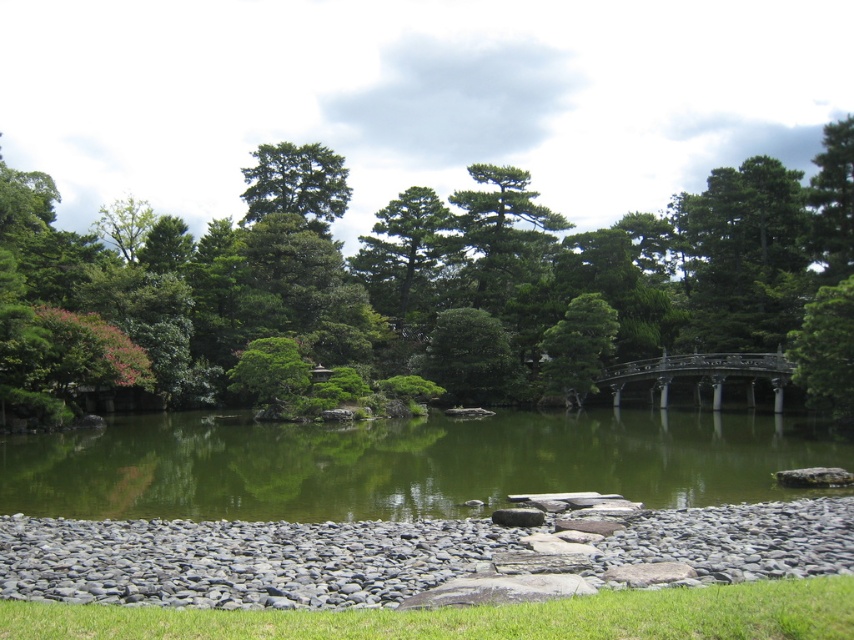
You are standing at the entrance of the Japanese garden and want to find the green matte tree at center. According to the garden layout, where should you look relative to the pebble path?

The green matte tree at center is located at point coordinates of 0.397 on the x and 0.477 on the y, so you should look towards the center area of the garden where the coordinates intersect.

You are standing at the entrance of the Japanese garden and want to take a photo of the green leafy tree at center. If you move 0.1 units to the right along the x axis, will you be closer to the tree?

The green leafy tree at center is located at point 0.441 in the x coordinate. Moving 0.1 units to the right would bring you to 0.541, which is further away from the tree along the x axis. Therefore, you will be farther from the tree.

You are standing in a Japanese garden and want to take a photo of the green matte tree at upper center. If your camera has a maximum zoom range of 200 feet, will you be able to capture the tree in focus without moving closer?

The green matte tree at upper center is 256.20 feet away from the viewer. Since the camera can only zoom up to 200 feet, you will not be able to capture the tree in focus without moving closer.